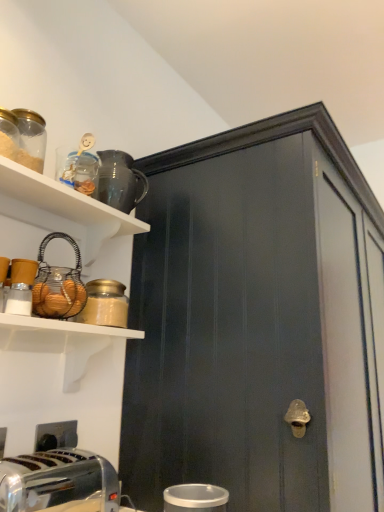
Question: Is glossy ceramic pitcher at upper center, which appears as the second appliance when viewed from the right, facing away from matte glass jar at upper left?

Choices:
 (A) yes
 (B) no

Answer: (B)

Question: Is glossy ceramic pitcher at upper center, placed as the third appliance when sorted from front to back, further to the viewer compared to matte glass jar at upper left?

Choices:
 (A) no
 (B) yes

Answer: (B)

Question: From the image's perspective, is glossy ceramic pitcher at upper center, which is counted as the first appliance, starting from the top, on top of matte glass jar at upper left?

Choices:
 (A) no
 (B) yes

Answer: (B)

Question: From the image's perspective, does glossy ceramic pitcher at upper center, which appears as the second appliance when viewed from the right, appear lower than matte glass jar at upper left?

Choices:
 (A) no
 (B) yes

Answer: (A)

Question: Is glossy ceramic pitcher at upper center, the 2th appliance when ordered from left to right, bigger than matte glass jar at upper left?

Choices:
 (A) yes
 (B) no

Answer: (A)

Question: Considering the relative sizes of wire basket at upper left, the second appliance when ordered from front to back, and matte black mug at upper left in the image provided, is wire basket at upper left, the second appliance when ordered from front to back, bigger than matte black mug at upper left?

Choices:
 (A) no
 (B) yes

Answer: (A)

Question: Can you confirm if wire basket at upper left, which is counted as the second appliance, starting from the bottom, is shorter than matte black mug at upper left?

Choices:
 (A) no
 (B) yes

Answer: (A)

Question: Is matte black mug at upper left at the back of wire basket at upper left, which is counted as the second appliance, starting from the bottom?

Choices:
 (A) no
 (B) yes

Answer: (A)

Question: Is wire basket at upper left, the 2th appliance from the top, closer to the viewer compared to matte black mug at upper left?

Choices:
 (A) no
 (B) yes

Answer: (A)

Question: From the image's perspective, would you say wire basket at upper left, which is counted as the second appliance, starting from the bottom, is shown under matte black mug at upper left?

Choices:
 (A) yes
 (B) no

Answer: (A)

Question: Does wire basket at upper left, which is counted as the second appliance, starting from the bottom, appear on the left side of matte black mug at upper left?

Choices:
 (A) no
 (B) yes

Answer: (B)

Question: Is the position of polished chrome toaster at lower left less distant than that of matte black cabinet at center?

Choices:
 (A) no
 (B) yes

Answer: (B)